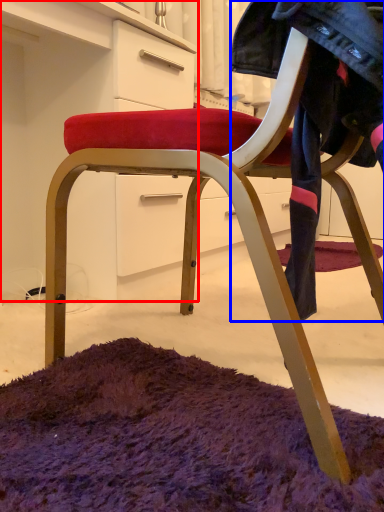
Question: Which object is further to the camera taking this photo, dresser (highlighted by a red box) or clothing (highlighted by a blue box)?

Choices:
 (A) dresser
 (B) clothing

Answer: (A)